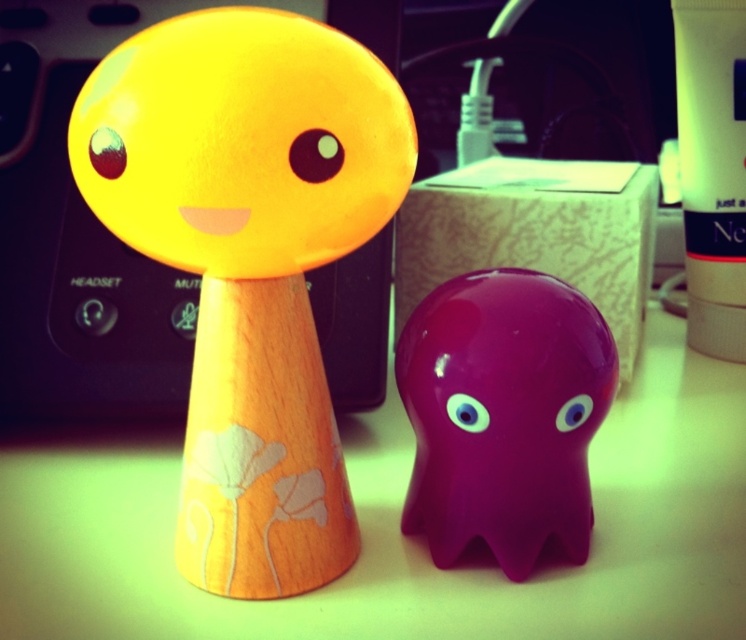
Who is shorter, matte black eye at upper center or blue glossy eye at center?

Standing shorter between the two is blue glossy eye at center.

Between matte black eye at upper center and blue glossy eye at center, which one is positioned higher?

matte black eye at upper center is higher up.

Is point (341, 152) positioned before point (583, 396)?

Yes, point (341, 152) is in front of point (583, 396).

Locate an element on the screen. The height and width of the screenshot is (640, 746). matte black eye at upper center is located at coordinates (316, 156).

Measure the distance between point (x=344, y=170) and camera.

They are 22.17 inches apart.

Between point (75, 136) and point (571, 400), which one is positioned in front?

Positioned in front is point (75, 136).

Does point (307, 572) come in front of point (586, 394)?

No, it is behind (586, 394).

Image resolution: width=746 pixels, height=640 pixels. Identify the location of wooden yellow figurine at center. (248, 264).

Can you confirm if wooden yellow figurine at center is wider than matte black eye at upper center?

Yes.

Is wooden yellow figurine at center closer to camera compared to matte black eye at upper center?

Yes, wooden yellow figurine at center is in front of matte black eye at upper center.

Between point (128, 148) and point (322, 157), which one is positioned behind?

Positioned behind is point (322, 157).

Where is `wooden yellow figurine at center`? This screenshot has width=746, height=640. wooden yellow figurine at center is located at coordinates (248, 264).